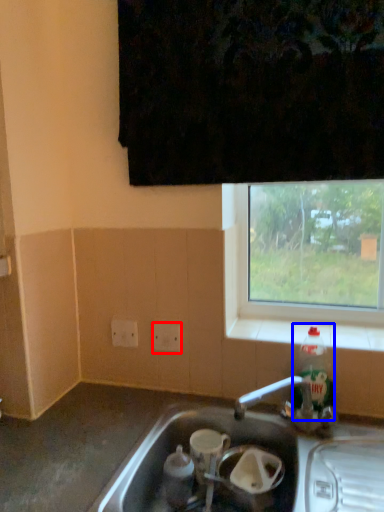
Question: Which object appears closest to the camera in this image, electric outlet (highlighted by a red box) or bottle (highlighted by a blue box)?

Choices:
 (A) electric outlet
 (B) bottle

Answer: (B)